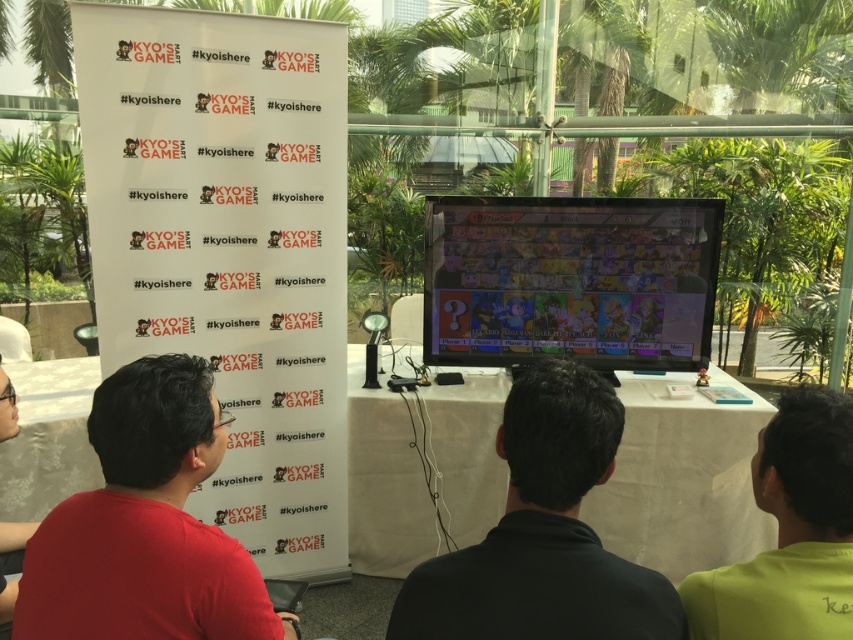
Question: Estimate the real-world distances between objects in this image. Which object is closer to the matte red shirt at left?

Choices:
 (A) matte plastic tv at center
 (B) green matte shirt at lower right

Answer: (B)

Question: Can you confirm if black matte shirt at center is bigger than green matte shirt at lower right?

Choices:
 (A) yes
 (B) no

Answer: (A)

Question: Which object is closer to the camera taking this photo?

Choices:
 (A) black matte shirt at center
 (B) green matte shirt at lower right

Answer: (A)

Question: Does matte plastic tv at center come in front of black matte shirt at center?

Choices:
 (A) yes
 (B) no

Answer: (B)

Question: Can you confirm if matte red shirt at left is wider than green matte shirt at lower right?

Choices:
 (A) yes
 (B) no

Answer: (A)

Question: Which point is farther to the camera?

Choices:
 (A) (548, 435)
 (B) (793, 458)

Answer: (B)